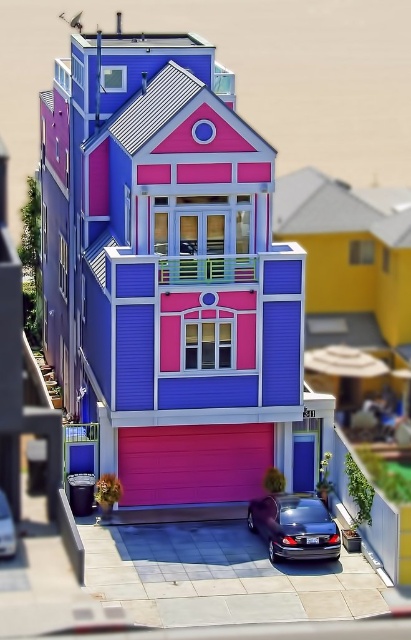
You are a delivery person trying to park a new car that is 2 meters wide in the driveway. There are two cars already parked there, a glossy metallic car at lower center and a shiny metallic car at lower center. Can you fit your car between them if the space between them is exactly 3 meters wide?

The glossy metallic car at lower center is wider than the shiny metallic car at lower center. Since the space between them is 3 meters wide, and your car is only 2 meters wide, you can fit your car between them as the total width required would be less than the available space.

Consider the image. You are standing at the front of the house and want to take a photo of both point (286,554) and point (13,554). Which point will appear closer to the camera in the photo?

Point (13,554) will appear closer to the camera in the photo because it is in front of point (286,554).